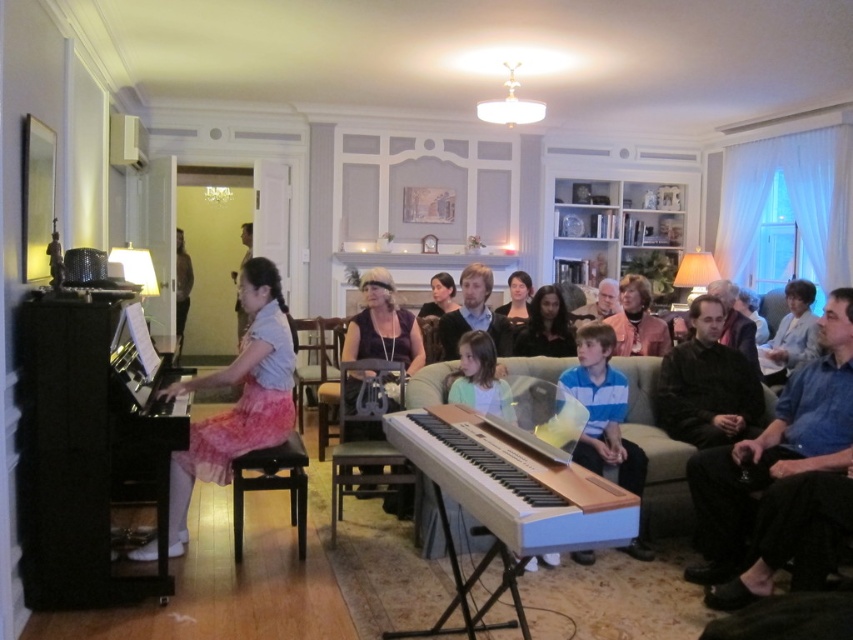
You are organizing a small concert in this room and need to ensure there is enough space for all attendees. Given the presence of the matte purple blouse at center and the dark brown leather jacket at left, which of these two items takes up more physical space in the scene?

The dark brown leather jacket at left takes up more physical space than the matte purple blouse at center.

You are a photographer positioned at the back of the room. You want to take a photo of the matte purple blouse at center and the dark brown leather jacket at left. Which one will be closer to the camera in the photo?

The matte purple blouse at center is in front of the dark brown leather jacket at left, so it will be closer to the camera in the photo.